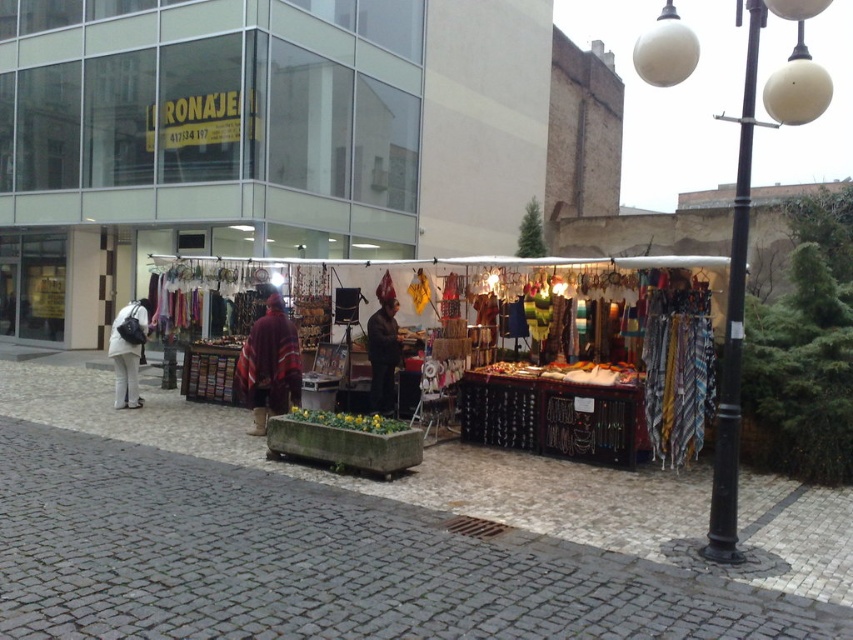
Is knitted woolen shawl at center closer to camera compared to dark brown leather jacket at center?

That is True.

Measure the distance between knitted woolen shawl at center and camera.

knitted woolen shawl at center and camera are 9.05 meters apart from each other.

The width and height of the screenshot is (853, 640). I want to click on knitted woolen shawl at center, so click(x=270, y=365).

Which is more to the right, dark brown leather jacket at center or white matte coat at left?

Positioned to the right is dark brown leather jacket at center.

Is point (384, 365) less distant than point (117, 401)?

Yes, point (384, 365) is in front of point (117, 401).

Between point (383, 397) and point (134, 348), which one is positioned in front?

Positioned in front is point (383, 397).

Identify the location of dark brown leather jacket at center. This screenshot has height=640, width=853. (383, 355).

Is textured fabric market at center in front of knitted woolen shawl at center?

No, textured fabric market at center is behind knitted woolen shawl at center.

Describe the element at coordinates (534, 340) in the screenshot. Image resolution: width=853 pixels, height=640 pixels. I see `textured fabric market at center` at that location.

Locate an element on the screen. textured fabric market at center is located at coordinates (534, 340).